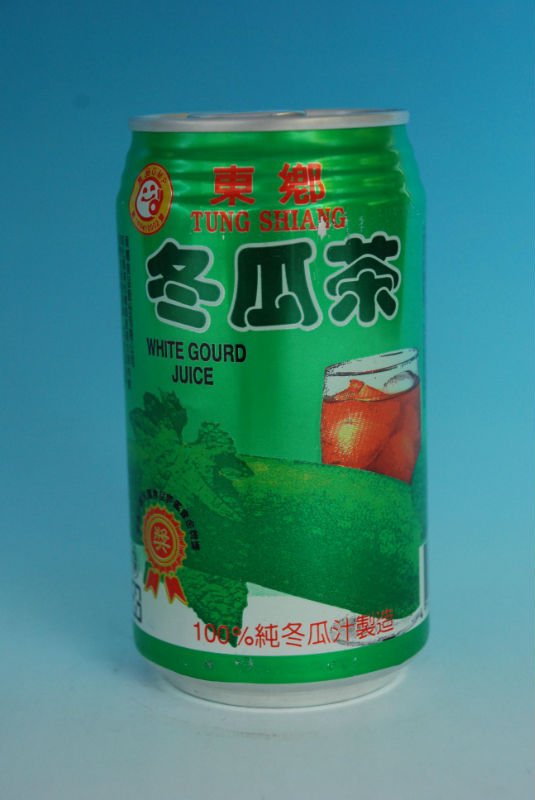
Where is `glass cups`? The height and width of the screenshot is (800, 535). glass cups is located at coordinates point(326,377).